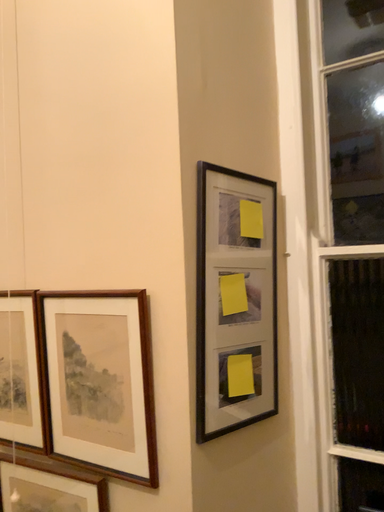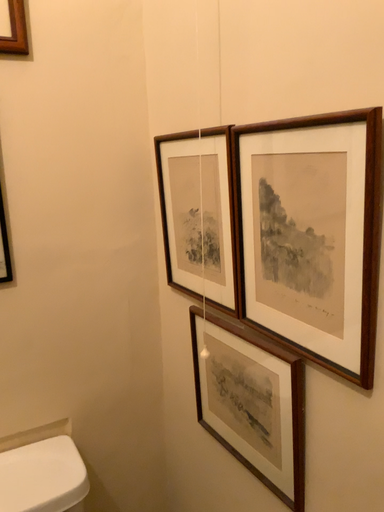
Question: Which way did the camera rotate in the video?

Choices:
 (A) rotated left
 (B) rotated right

Answer: (A)